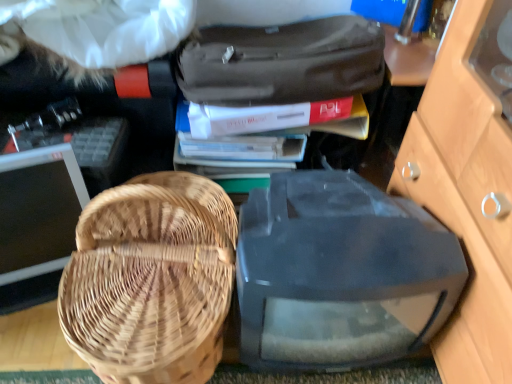
Measure the distance between point (259, 147) and camera.

Point (259, 147) and camera are 38.39 inches apart from each other.

This screenshot has height=384, width=512. Describe the element at coordinates (38, 211) in the screenshot. I see `matte black monitor at left, the 2th computer monitor viewed from the right` at that location.

I want to click on transparent plastic computer monitor at center, the 1th computer monitor positioned from the right, so click(340, 273).

Locate an element on the screen. woven wood picnic basket at left is located at coordinates (151, 280).

Consider the image. Would you say white paper book at center, which is the 1th book in bottom-to-top order, contains transparent plastic computer monitor at center, the second computer monitor viewed from the left?

No.

Is white paper book at center, which is the 1th book in bottom-to-top order, positioned behind transparent plastic computer monitor at center, the 1th computer monitor positioned from the right?

Yes, the depth of white paper book at center, which is the 1th book in bottom-to-top order, is greater than that of transparent plastic computer monitor at center, the 1th computer monitor positioned from the right.

Can you tell me how much white paper book at center, marked as the second book in a top-to-bottom arrangement, and transparent plastic computer monitor at center, the second computer monitor viewed from the left, differ in facing direction?

There is a 3.41-degree angle between the facing directions of white paper book at center, marked as the second book in a top-to-bottom arrangement, and transparent plastic computer monitor at center, the second computer monitor viewed from the left.

Is white paper book at center, which is the 1th book in bottom-to-top order, positioned with its back to transparent plastic computer monitor at center, the second computer monitor viewed from the left?

white paper book at center, which is the 1th book in bottom-to-top order, is not turned away from transparent plastic computer monitor at center, the second computer monitor viewed from the left.

Is woven wood picnic basket at left bigger or smaller than transparent plastic computer monitor at center, the 1th computer monitor positioned from the right?

Considering their sizes, woven wood picnic basket at left takes up less space than transparent plastic computer monitor at center, the 1th computer monitor positioned from the right.

Is woven wood picnic basket at left looking in the opposite direction of transparent plastic computer monitor at center, the 1th computer monitor positioned from the right?

No.

From a real-world perspective, is woven wood picnic basket at left beneath transparent plastic computer monitor at center, the 1th computer monitor positioned from the right?

No, from a real-world perspective, woven wood picnic basket at left is not below transparent plastic computer monitor at center, the 1th computer monitor positioned from the right.

Based on the photo, which is correct: matte gray book at upper center, the second book ordered from the bottom, is inside woven wood picnic basket at left, or outside of it?

matte gray book at upper center, the second book ordered from the bottom, is located beyond the bounds of woven wood picnic basket at left.

Could you tell me if matte gray book at upper center, placed as the 1th book when sorted from top to bottom, is facing woven wood picnic basket at left?

No, matte gray book at upper center, placed as the 1th book when sorted from top to bottom, does not turn towards woven wood picnic basket at left.

How much distance is there between matte gray book at upper center, the second book ordered from the bottom, and woven wood picnic basket at left?

matte gray book at upper center, the second book ordered from the bottom, and woven wood picnic basket at left are 11.53 inches apart from each other.

Is matte gray book at upper center, placed as the 1th book when sorted from top to bottom, far away from woven wood picnic basket at left?

matte gray book at upper center, placed as the 1th book when sorted from top to bottom, is near woven wood picnic basket at left, not far away.

Looking at this image, is matte black suitcase at upper center shorter than white paper book at center, which is the 1th book in bottom-to-top order?

No.

Is point (321, 55) closer to viewer compared to point (233, 145)?

That is True.

Consider the image. From the image's perspective, which is above, matte black suitcase at upper center or white paper book at center, which is the 1th book in bottom-to-top order?

matte black suitcase at upper center, from the image's perspective.

Does matte black suitcase at upper center have a larger size compared to white paper book at center, which is the 1th book in bottom-to-top order?

Indeed, matte black suitcase at upper center has a larger size compared to white paper book at center, which is the 1th book in bottom-to-top order.

Consider the image. How different are the orientations of white paper book at center, marked as the second book in a top-to-bottom arrangement, and matte gray book at upper center, placed as the 1th book when sorted from top to bottom, in degrees?

8.46 degrees.

Identify the location of book that appears above the white paper book at center, marked as the second book in a top-to-bottom arrangement (from the image's perspective). This screenshot has height=384, width=512. point(282,118).

Looking at their sizes, would you say white paper book at center, marked as the second book in a top-to-bottom arrangement, is wider or thinner than matte gray book at upper center, placed as the 1th book when sorted from top to bottom?

Considering their sizes, white paper book at center, marked as the second book in a top-to-bottom arrangement, looks slimmer than matte gray book at upper center, placed as the 1th book when sorted from top to bottom.

Is white paper book at center, which is the 1th book in bottom-to-top order, positioned with its back to matte gray book at upper center, placed as the 1th book when sorted from top to bottom?

No, matte gray book at upper center, placed as the 1th book when sorted from top to bottom, is not at the back of white paper book at center, which is the 1th book in bottom-to-top order.

Measure the distance from woven wood picnic basket at left to matte black suitcase at upper center.

woven wood picnic basket at left and matte black suitcase at upper center are 13.28 inches apart.

Considering the sizes of objects woven wood picnic basket at left and matte black suitcase at upper center in the image provided, who is thinner, woven wood picnic basket at left or matte black suitcase at upper center?

matte black suitcase at upper center.

Between point (189, 237) and point (338, 33), which one is positioned in front?

The point (189, 237) is closer to the camera.

Between woven wood picnic basket at left and matte black suitcase at upper center, which one has smaller size?

Smaller between the two is matte black suitcase at upper center.

Between woven wood picnic basket at left and matte gray book at upper center, placed as the 1th book when sorted from top to bottom, which one is positioned in front?

woven wood picnic basket at left is in front.

From the image's perspective, which one is positioned higher, woven wood picnic basket at left or matte gray book at upper center, placed as the 1th book when sorted from top to bottom?

matte gray book at upper center, placed as the 1th book when sorted from top to bottom, from the image's perspective.

Considering the sizes of woven wood picnic basket at left and matte gray book at upper center, placed as the 1th book when sorted from top to bottom, in the image, is woven wood picnic basket at left bigger or smaller than matte gray book at upper center, placed as the 1th book when sorted from top to bottom,?

Clearly, woven wood picnic basket at left is larger in size than matte gray book at upper center, placed as the 1th book when sorted from top to bottom.

Measure the distance from woven wood picnic basket at left to matte gray book at upper center, placed as the 1th book when sorted from top to bottom.

A distance of 11.53 inches exists between woven wood picnic basket at left and matte gray book at upper center, placed as the 1th book when sorted from top to bottom.

From the image's perspective, starting from the transparent plastic computer monitor at center, the second computer monitor viewed from the left, which book is the 1st one above? Please provide its 2D coordinates.

[(245, 147)]

Where is `picnic basket in front of the transparent plastic computer monitor at center, the second computer monitor viewed from the left`? This screenshot has width=512, height=384. picnic basket in front of the transparent plastic computer monitor at center, the second computer monitor viewed from the left is located at coordinates point(151,280).

Estimate the real-world distances between objects in this image. Which object is closer to transparent plastic computer monitor at center, the second computer monitor viewed from the left, matte black suitcase at upper center or white paper book at center, which is the 1th book in bottom-to-top order?

Based on the image, matte black suitcase at upper center appears to be nearer to transparent plastic computer monitor at center, the second computer monitor viewed from the left.

When comparing their distances from transparent plastic computer monitor at center, the second computer monitor viewed from the left, does matte gray book at upper center, the second book ordered from the bottom, or matte black suitcase at upper center seem further?

matte black suitcase at upper center lies further to transparent plastic computer monitor at center, the second computer monitor viewed from the left, than the other object.

Based on their spatial positions, is matte gray book at upper center, placed as the 1th book when sorted from top to bottom, or transparent plastic computer monitor at center, the second computer monitor viewed from the left, further from white paper book at center, which is the 1th book in bottom-to-top order?

transparent plastic computer monitor at center, the second computer monitor viewed from the left, lies further to white paper book at center, which is the 1th book in bottom-to-top order, than the other object.

Looking at the image, which one is located further to transparent plastic computer monitor at center, the second computer monitor viewed from the left, woven wood picnic basket at left or matte black suitcase at upper center?

matte black suitcase at upper center.

Which object lies nearer to the anchor point matte black monitor at left, the 1th computer monitor when ordered from left to right, transparent plastic computer monitor at center, the 1th computer monitor positioned from the right, or matte gray book at upper center, placed as the 1th book when sorted from top to bottom?

matte gray book at upper center, placed as the 1th book when sorted from top to bottom, is positioned closer to the anchor matte black monitor at left, the 1th computer monitor when ordered from left to right.

From the picture: Which object lies nearer to the anchor point matte black monitor at left, the 2th computer monitor viewed from the right, matte black suitcase at upper center or transparent plastic computer monitor at center, the 1th computer monitor positioned from the right?

matte black suitcase at upper center is closer to matte black monitor at left, the 2th computer monitor viewed from the right.

Considering their positions, is woven wood picnic basket at left positioned closer to matte black monitor at left, the 1th computer monitor when ordered from left to right, than transparent plastic computer monitor at center, the second computer monitor viewed from the left?

woven wood picnic basket at left is positioned closer to the anchor matte black monitor at left, the 1th computer monitor when ordered from left to right.

Estimate the real-world distances between objects in this image. Which object is closer to transparent plastic computer monitor at center, the 1th computer monitor positioned from the right, matte black suitcase at upper center or matte black monitor at left, the 2th computer monitor viewed from the right?

matte black suitcase at upper center is closer to transparent plastic computer monitor at center, the 1th computer monitor positioned from the right.

You are a GUI agent. You are given a task and a screenshot of the screen. Output one action in this format:
    pyautogui.click(x=<x>, y=<y>)
    Task: Click on the luggage and bags positioned between woven wood picnic basket at left and white paper book at center, which is the 1th book in bottom-to-top order, from near to far
    
    Given the screenshot: What is the action you would take?
    pyautogui.click(x=281, y=62)

What are the coordinates of `book between transparent plastic computer monitor at center, the 1th computer monitor positioned from the right, and white paper book at center, which is the 1th book in bottom-to-top order, in the front-back direction` in the screenshot? It's located at (282, 118).

This screenshot has width=512, height=384. In order to click on book positioned between woven wood picnic basket at left and white paper book at center, marked as the second book in a top-to-bottom arrangement, from near to far in this screenshot , I will do click(x=282, y=118).

Identify the location of book between matte black suitcase at upper center and white paper book at center, marked as the second book in a top-to-bottom arrangement, from front to back. Image resolution: width=512 pixels, height=384 pixels. (282, 118).